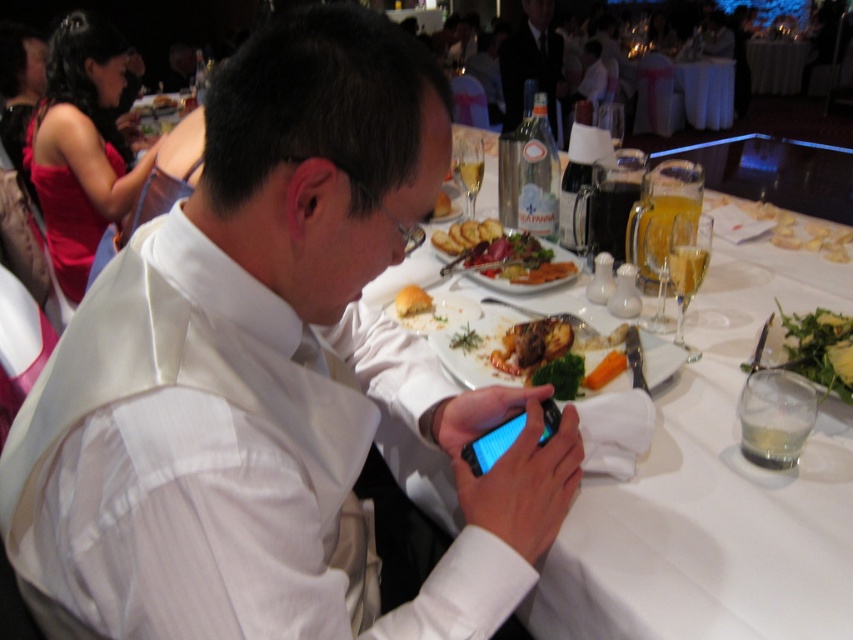
Is shiny red dress at upper left to the right of golden brown roasted meat at center from the viewer's perspective?

No, shiny red dress at upper left is not to the right of golden brown roasted meat at center.

Identify the location of shiny red dress at upper left. (80, 147).

Between black glossy smartphone at center and white bread at center, which one has less height?

white bread at center

Measure the distance between point (502, 445) and camera.

A distance of 32.46 inches exists between point (502, 445) and camera.

Who is more distant from viewer, (473, 444) or (409, 314)?

Positioned behind is point (409, 314).

Locate an element on the screen. black glossy smartphone at center is located at coordinates (492, 444).

What do you see at coordinates (80, 147) in the screenshot?
I see `shiny red dress at upper left` at bounding box center [80, 147].

Does shiny red dress at upper left have a greater height compared to golden brown bread at center?

Yes.

Is point (41, 200) positioned in front of point (457, 237)?

No.

Identify the location of shiny red dress at upper left. (80, 147).